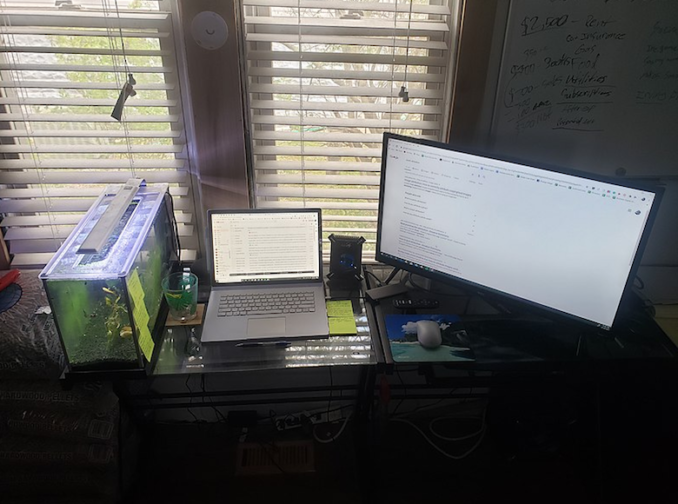
You are a GUI agent. You are given a task and a screenshot of the screen. Output one action in this format:
    pyautogui.click(x=<x>, y=<y>)
    Task: Click on the mouse pad
    The height and width of the screenshot is (504, 678).
    Given the screenshot: What is the action you would take?
    pyautogui.click(x=407, y=347)